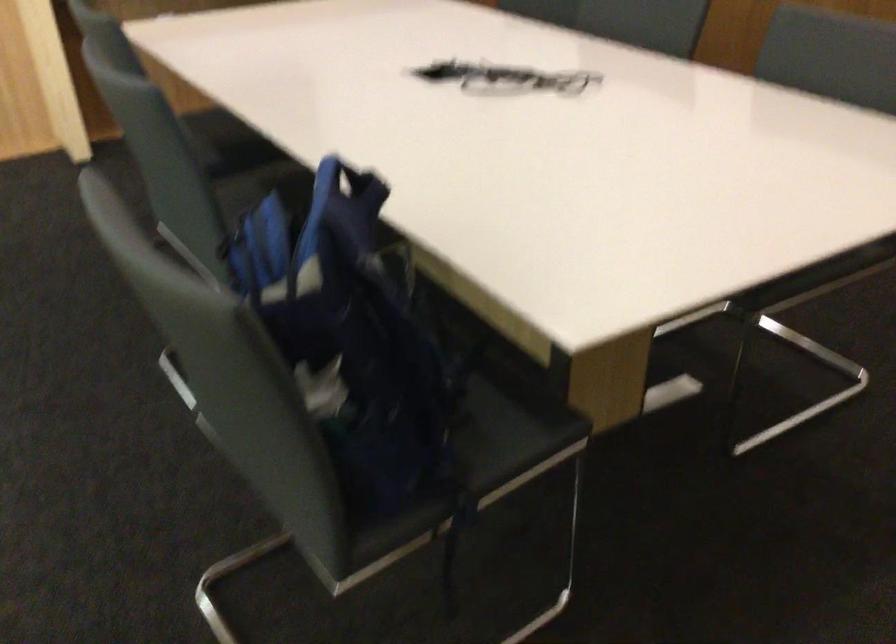
I want to click on blue backpack handle, so click(x=349, y=184).